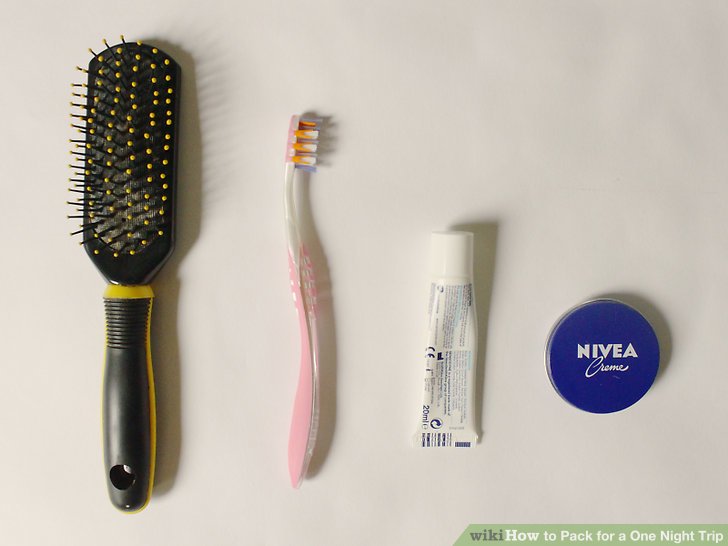
At what (x,y) coordinates should I click in order to perform the action: click on hairbrush handle. Please return your answer as a coordinate pair (x, y). Image resolution: width=728 pixels, height=546 pixels. Looking at the image, I should click on (143, 400).